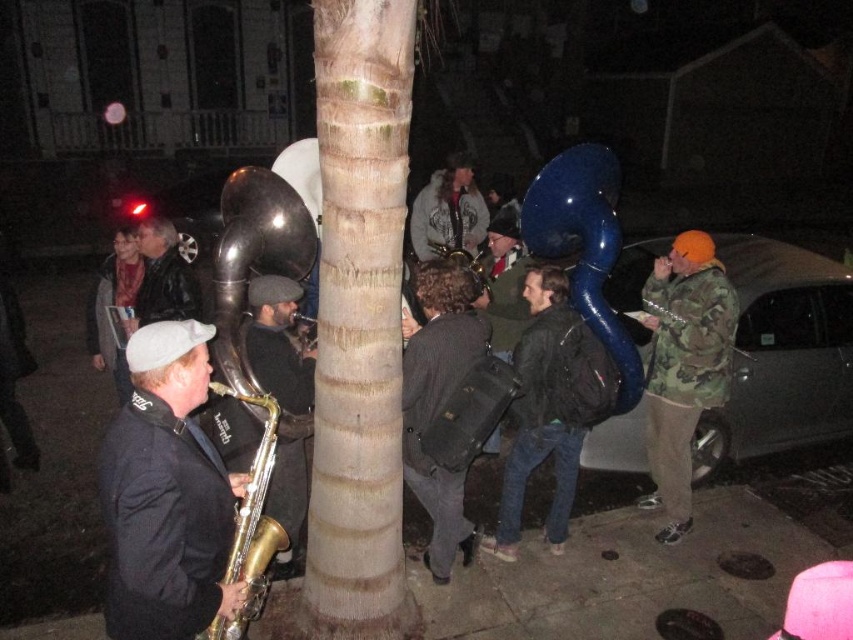
Question: Among these points, which one is farthest from the camera?

Choices:
 (A) (461, 257)
 (B) (268, 442)
 (C) (265, 365)

Answer: (A)

Question: Among these objects, which one is farthest from the camera?

Choices:
 (A) gold brass saxophone at center
 (B) gold shiny saxophone at left
 (C) gold brass saxophone at left
 (D) shiny silver saxophone at center

Answer: (D)

Question: From the image, what is the correct spatial relationship of metallic silver car at right in relation to matte blue tuba at center?

Choices:
 (A) below
 (B) above

Answer: (A)

Question: Which object is positioned closest to the dark gray fabric backpack at center?

Choices:
 (A) shiny silver saxophone at center
 (B) blue rubber balloon at right

Answer: (B)

Question: Is smooth bark tree trunk at center in front of dark gray fabric backpack at center?

Choices:
 (A) no
 (B) yes

Answer: (B)

Question: From the image, what is the correct spatial relationship of smooth bark tree trunk at center in relation to shiny silver saxophone at center?

Choices:
 (A) below
 (B) above

Answer: (A)